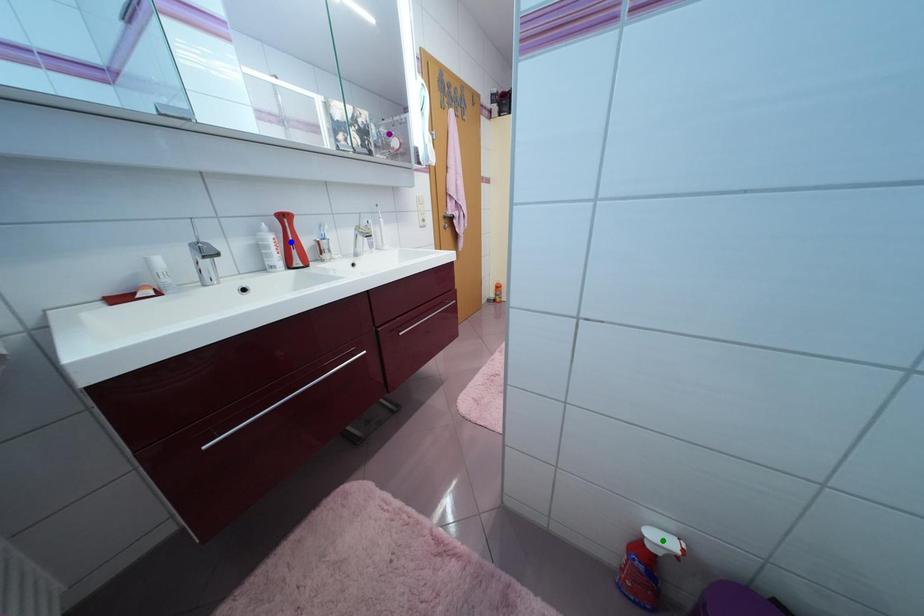
Order these from farthest to nearest:
blue point
green point
purple point

purple point
blue point
green point